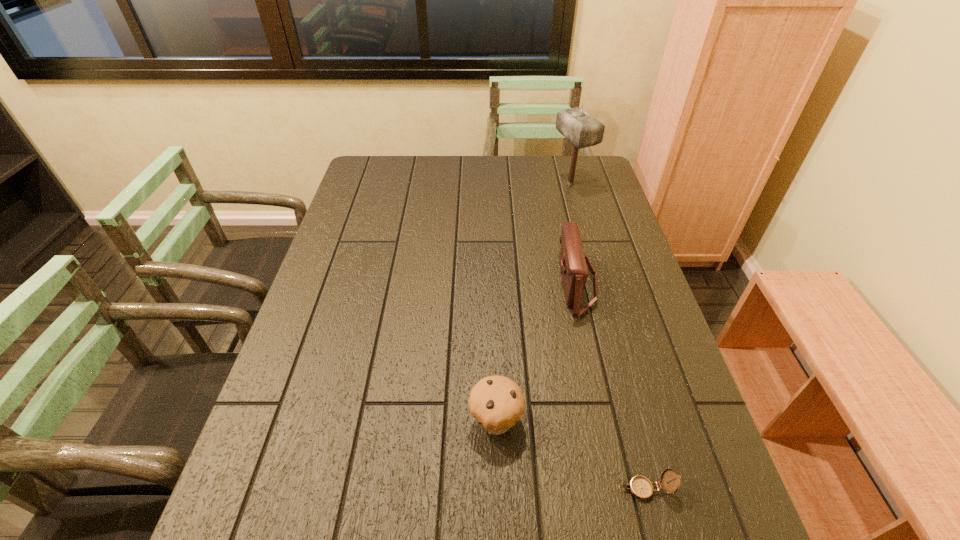
Locate an element on the screen. vacant space positioned on the front flap of the second tallest object is located at coordinates (430, 283).

Identify the location of vacant point located on the front flap of the second tallest object. (484, 283).

This screenshot has width=960, height=540. I want to click on free space located 0.060m on the left of the leftmost object, so click(441, 421).

At what (x,y) coordinates should I click in order to perform the action: click on vacant space located on the face of the nearest object. Please return your answer as a coordinate pair (x, y). This screenshot has height=540, width=960. Looking at the image, I should click on (486, 489).

You are a GUI agent. You are given a task and a screenshot of the screen. Output one action in this format:
    pyautogui.click(x=<x>, y=<y>)
    Task: Click on the free spot located 0.290m on the face of the nearest object
    
    Given the screenshot: What is the action you would take?
    pyautogui.click(x=465, y=489)

What are the coordinates of `blank space located on the face of the nearest object` in the screenshot? It's located at (534, 489).

The width and height of the screenshot is (960, 540). What are the coordinates of `object located at the far edge` in the screenshot? It's located at (583, 130).

This screenshot has width=960, height=540. What are the coordinates of `mallet that is at the right edge` in the screenshot? It's located at (583, 130).

At what (x,y) coordinates should I click in order to perform the action: click on shoulder bag located in the right edge section of the desktop. Please return your answer as a coordinate pair (x, y). Image resolution: width=960 pixels, height=540 pixels. Looking at the image, I should click on (574, 271).

This screenshot has width=960, height=540. What are the coordinates of `compass present at the right edge` in the screenshot? It's located at (640, 487).